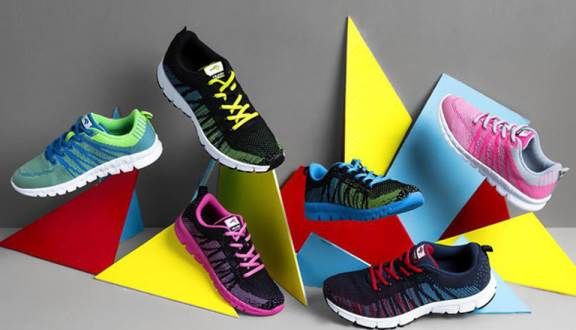
This screenshot has height=330, width=576. What are the coordinates of `shoe` in the screenshot? It's located at (484, 148), (334, 191), (401, 286), (218, 258), (187, 97), (102, 160).